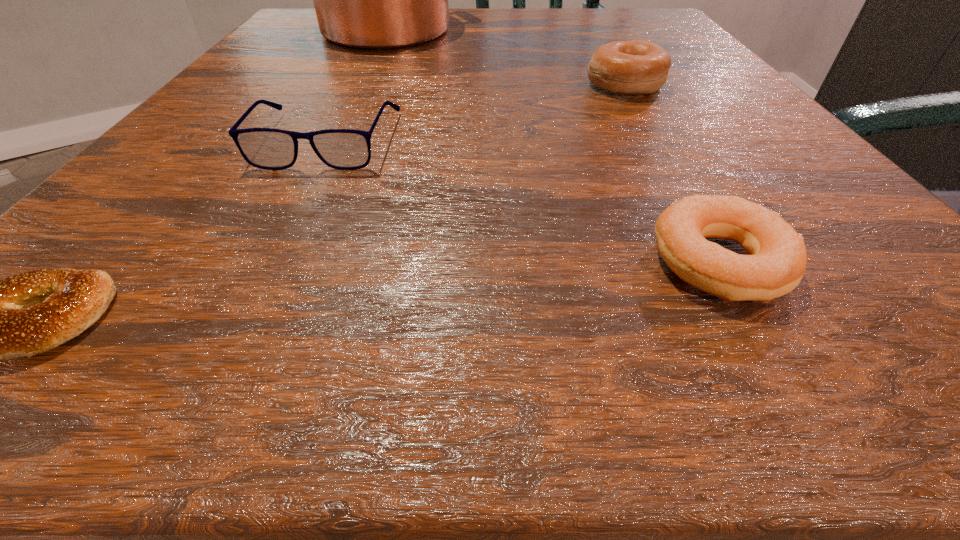
Identify the location of the farthest object. (370, 0).

Where is `the tallest object`? This screenshot has height=540, width=960. the tallest object is located at coordinates (370, 0).

Find the location of a particular element. The height and width of the screenshot is (540, 960). the tallest bagel is located at coordinates (636, 67).

Find the location of a particular element. The image size is (960, 540). the second farthest object is located at coordinates (636, 67).

Identify the location of spectacles. (266, 148).

I want to click on the second shortest object, so [776, 261].

The width and height of the screenshot is (960, 540). Identify the location of vacant space situated 0.050m on the front of the saucepan. (370, 63).

At what (x,y) coordinates should I click in order to perform the action: click on vacant region located on the left of the fourth nearest object. Please return your answer as a coordinate pair (x, y). Looking at the image, I should click on (490, 85).

At what (x,y) coordinates should I click in order to perform the action: click on vacant area situated 0.110m on the front-facing side of the spectacles. Please return your answer as a coordinate pair (x, y). Looking at the image, I should click on (283, 231).

Locate an element on the screen. This screenshot has height=540, width=960. vacant space situated on the back of the second shortest object is located at coordinates (658, 152).